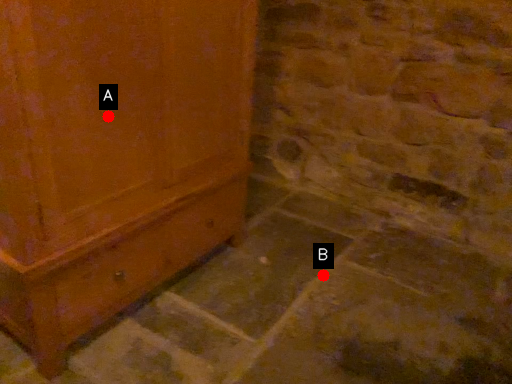
Question: Two points are circled on the image, labeled by A and B beside each circle. Which point is closer to the camera?

Choices:
 (A) A is closer
 (B) B is closer

Answer: (A)